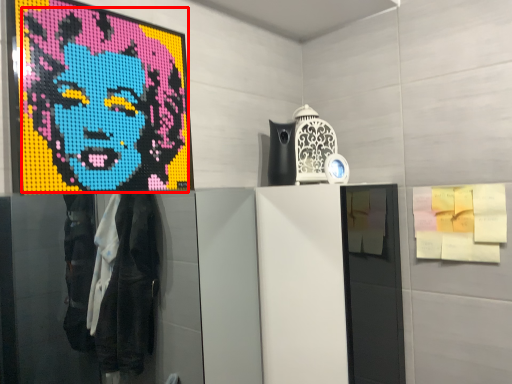
Question: From the image's perspective, what is the correct spatial positioning of person (annotated by the red box) in reference to poster?

Choices:
 (A) above
 (B) below

Answer: (A)